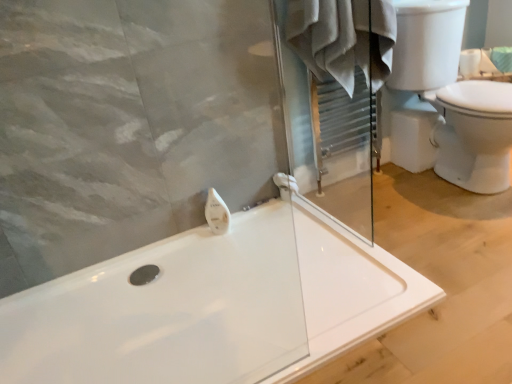
Locate an element on the screen. The width and height of the screenshot is (512, 384). free region on the left part of white glossy soap dispenser at upper center is located at coordinates (185, 244).